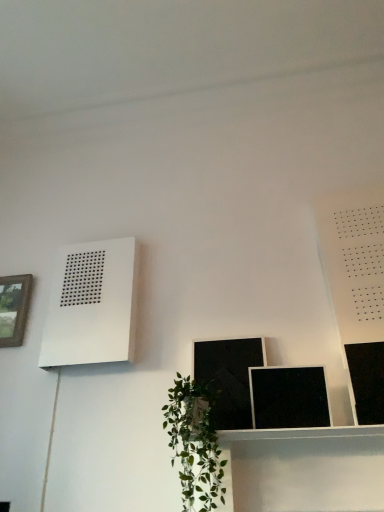
The image size is (384, 512). What do you see at coordinates (228, 377) in the screenshot?
I see `matte black picture frame at lower center, acting as the third picture frame starting from the front` at bounding box center [228, 377].

How much space does wooden framed picture at left, the first picture frame in the back-to-front sequence, occupy horizontally?

It is 1.68 inches.

What is the approximate height of black glossy picture frame at upper right, which ranks as the 4th picture frame in back-to-front order?

11.71 inches.

How much space does black glossy picture frame at upper right, which is the fourth picture frame in left-to-right order, occupy horizontally?

1.86 inches.

This screenshot has height=512, width=384. In order to click on matte black picture frame at lower center, the third picture frame when ordered from right to left in this screenshot , I will do `click(228, 377)`.

Find the location of `the 3rd picture frame to the right when counting from the white matte air conditioner at upper left`. the 3rd picture frame to the right when counting from the white matte air conditioner at upper left is located at coordinates (366, 381).

Is black glossy picture frame at upper right, which ranks as the 4th picture frame in back-to-front order, surrounded by white matte air conditioner at upper left?

Definitely not — black glossy picture frame at upper right, which ranks as the 4th picture frame in back-to-front order, is not inside white matte air conditioner at upper left.

From a real-world perspective, between white matte air conditioner at upper left and black glossy picture frame at upper right, the 1th picture frame viewed from the front, who is vertically higher?

white matte air conditioner at upper left, from a real-world perspective.

Is white matte air conditioner at upper left further to the viewer compared to black glossy picture frame at upper right, the 1th picture frame viewed from the front?

Yes, white matte air conditioner at upper left is further from the camera.

Which of these two, white matte air conditioner at upper left or black matte picture frame at lower center, which is counted as the 3th picture frame, starting from the left, is thinner?

black matte picture frame at lower center, which is counted as the 3th picture frame, starting from the left.

From the picture: Is white matte air conditioner at upper left closer to camera compared to black matte picture frame at lower center, placed as the 3th picture frame when sorted from back to front?

No, white matte air conditioner at upper left is further to the viewer.

Looking at the image, does white matte air conditioner at upper left seem bigger or smaller compared to black matte picture frame at lower center, placed as the 3th picture frame when sorted from back to front?

Clearly, white matte air conditioner at upper left is larger in size than black matte picture frame at lower center, placed as the 3th picture frame when sorted from back to front.

In the scene shown: What's the angular difference between white matte air conditioner at upper left and black matte picture frame at lower center, the 2th picture frame when ordered from right to left,'s facing directions?

They differ by 0.978 degrees in their facing directions.

At what (x,y) coordinates should I click in order to perform the action: click on the 1st picture frame counting from the left of the black glossy picture frame at upper right, which ranks as the 4th picture frame in back-to-front order. Please return your answer as a coordinate pair (x, y). Image resolution: width=384 pixels, height=512 pixels. Looking at the image, I should click on (289, 397).

Which object is closer to the camera taking this photo, black matte picture frame at lower center, which is counted as the second picture frame, starting from the front, or black glossy picture frame at upper right, which ranks as the 4th picture frame in back-to-front order?

Positioned in front is black glossy picture frame at upper right, which ranks as the 4th picture frame in back-to-front order.

Does point (298, 409) come closer to viewer compared to point (354, 380)?

Yes, point (298, 409) is closer to viewer.

Who is taller, black glossy picture frame at upper right, which ranks as the 4th picture frame in back-to-front order, or black matte picture frame at lower center, which is counted as the second picture frame, starting from the front?

black glossy picture frame at upper right, which ranks as the 4th picture frame in back-to-front order, is taller.

Considering the sizes of objects black glossy picture frame at upper right, which is the fourth picture frame in left-to-right order, and black matte picture frame at lower center, placed as the 3th picture frame when sorted from back to front, in the image provided, who is smaller, black glossy picture frame at upper right, which is the fourth picture frame in left-to-right order, or black matte picture frame at lower center, placed as the 3th picture frame when sorted from back to front,?

With smaller size is black glossy picture frame at upper right, which is the fourth picture frame in left-to-right order.

From the image's perspective, which is above, black glossy picture frame at upper right, which ranks as the 4th picture frame in back-to-front order, or black matte picture frame at lower center, placed as the 3th picture frame when sorted from back to front?

From the image's view, black glossy picture frame at upper right, which ranks as the 4th picture frame in back-to-front order, is above.

Considering the relative sizes of white matte air conditioner at upper left and wooden framed picture at left, the first picture frame in the back-to-front sequence, in the image provided, is white matte air conditioner at upper left taller than wooden framed picture at left, the first picture frame in the back-to-front sequence,?

Correct, white matte air conditioner at upper left is much taller as wooden framed picture at left, the first picture frame in the back-to-front sequence.

What's the angular difference between white matte air conditioner at upper left and wooden framed picture at left, which is the fourth picture frame in front-to-back order,'s facing directions?

1.05 degrees.

Which object is wider, white matte air conditioner at upper left or wooden framed picture at left, the first picture frame positioned from the left?

white matte air conditioner at upper left is wider.

Visually, is black glossy picture frame at upper right, which ranks as the 4th picture frame in back-to-front order, positioned to the left or to the right of wooden framed picture at left, the first picture frame positioned from the left?

From the image, it's evident that black glossy picture frame at upper right, which ranks as the 4th picture frame in back-to-front order, is to the right of wooden framed picture at left, the first picture frame positioned from the left.

From the image's perspective, is black glossy picture frame at upper right, the 1th picture frame viewed from the front, located above or below wooden framed picture at left, the first picture frame in the back-to-front sequence?

black glossy picture frame at upper right, the 1th picture frame viewed from the front, is below wooden framed picture at left, the first picture frame in the back-to-front sequence.

From the image's perspective, count 1st picture frames downward from the wooden framed picture at left, which is the fourth picture frame in front-to-back order, and point to it. Please provide its 2D coordinates.

[(366, 381)]

Is green leafy plant at lower center looking in the opposite direction of wooden framed picture at left, which is the fourth picture frame in front-to-back order?

green leafy plant at lower center does not have its back to wooden framed picture at left, which is the fourth picture frame in front-to-back order.

Which object is thinner, green leafy plant at lower center or wooden framed picture at left, the 4th picture frame when ordered from right to left?

With smaller width is wooden framed picture at left, the 4th picture frame when ordered from right to left.

Which is in front, green leafy plant at lower center or wooden framed picture at left, the first picture frame positioned from the left?

green leafy plant at lower center.

Could you measure the distance between green leafy plant at lower center and wooden framed picture at left, the first picture frame positioned from the left?

green leafy plant at lower center and wooden framed picture at left, the first picture frame positioned from the left, are 37.29 inches apart from each other.

I want to click on air conditioner that appears on the left of black glossy picture frame at upper right, the 1th picture frame viewed from the front, so click(x=92, y=305).

Where is `air conditioner that is behind the black matte picture frame at lower center, which is counted as the second picture frame, starting from the front`? air conditioner that is behind the black matte picture frame at lower center, which is counted as the second picture frame, starting from the front is located at coordinates (92, 305).

Looking at the image, which one is located closer to wooden framed picture at left, the first picture frame positioned from the left, green leafy plant at lower center or black glossy picture frame at upper right, which is the fourth picture frame in left-to-right order?

Among the two, green leafy plant at lower center is located nearer to wooden framed picture at left, the first picture frame positioned from the left.

From the image, which object appears to be farther from black glossy picture frame at upper right, which is the fourth picture frame in left-to-right order, black matte picture frame at lower center, which is counted as the second picture frame, starting from the front, or green leafy plant at lower center?

Based on the image, green leafy plant at lower center appears to be further to black glossy picture frame at upper right, which is the fourth picture frame in left-to-right order.

When comparing their distances from green leafy plant at lower center, does white matte air conditioner at upper left or black matte picture frame at lower center, the 2th picture frame when ordered from right to left, seem further?

Among the two, white matte air conditioner at upper left is located further to green leafy plant at lower center.

Based on their spatial positions, is green leafy plant at lower center or white matte air conditioner at upper left closer to matte black picture frame at lower center, which ranks as the second picture frame in left-to-right order?

The object closer to matte black picture frame at lower center, which ranks as the second picture frame in left-to-right order, is green leafy plant at lower center.

Which object lies further to the anchor point white matte air conditioner at upper left, wooden framed picture at left, which is the fourth picture frame in front-to-back order, or black matte picture frame at lower center, which is counted as the second picture frame, starting from the front?

Based on the image, black matte picture frame at lower center, which is counted as the second picture frame, starting from the front, appears to be further to white matte air conditioner at upper left.

Looking at this image, looking at the image, which one is located closer to black glossy picture frame at upper right, which is the fourth picture frame in left-to-right order, white matte air conditioner at upper left or matte black picture frame at lower center, the third picture frame when ordered from right to left?

matte black picture frame at lower center, the third picture frame when ordered from right to left, is positioned closer to the anchor black glossy picture frame at upper right, which is the fourth picture frame in left-to-right order.

Looking at the image, which one is located further to white matte air conditioner at upper left, matte black picture frame at lower center, acting as the third picture frame starting from the front, or green leafy plant at lower center?

The object further to white matte air conditioner at upper left is green leafy plant at lower center.

Estimate the real-world distances between objects in this image. Which object is further from matte black picture frame at lower center, the 2th picture frame viewed from the back, white matte air conditioner at upper left or green leafy plant at lower center?

white matte air conditioner at upper left.

This screenshot has width=384, height=512. Find the location of `houseplant located between white matte air conditioner at upper left and black matte picture frame at lower center, the 2th picture frame when ordered from right to left, in the left-right direction`. houseplant located between white matte air conditioner at upper left and black matte picture frame at lower center, the 2th picture frame when ordered from right to left, in the left-right direction is located at coordinates (194, 445).

The height and width of the screenshot is (512, 384). What are the coordinates of `air conditioner situated between wooden framed picture at left, the first picture frame positioned from the left, and matte black picture frame at lower center, the third picture frame when ordered from right to left, from left to right` in the screenshot? It's located at 92,305.

In order to click on picture frame between white matte air conditioner at upper left and black matte picture frame at lower center, placed as the 3th picture frame when sorted from back to front, from left to right in this screenshot , I will do `click(228, 377)`.

Locate an element on the screen. picture frame between matte black picture frame at lower center, which ranks as the second picture frame in left-to-right order, and black glossy picture frame at upper right, the 1th picture frame viewed from the front, from left to right is located at coordinates (289, 397).